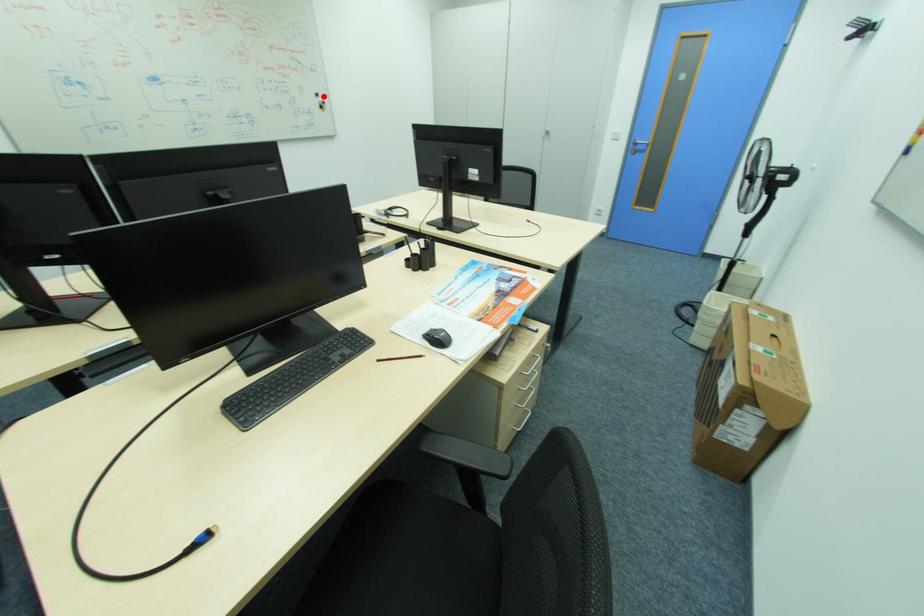
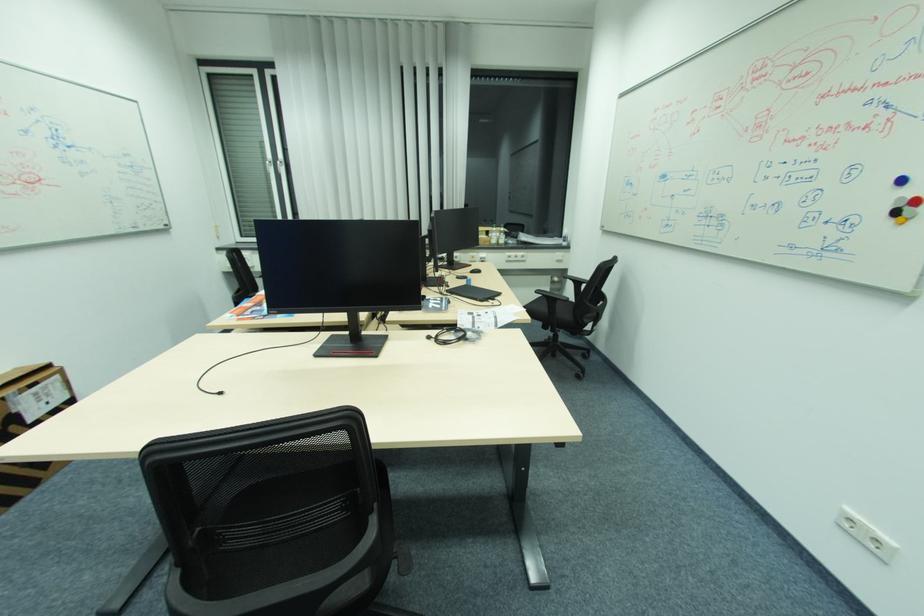
Find the pixel in the second image that matches the highlighted location in the first image.

(908, 180)